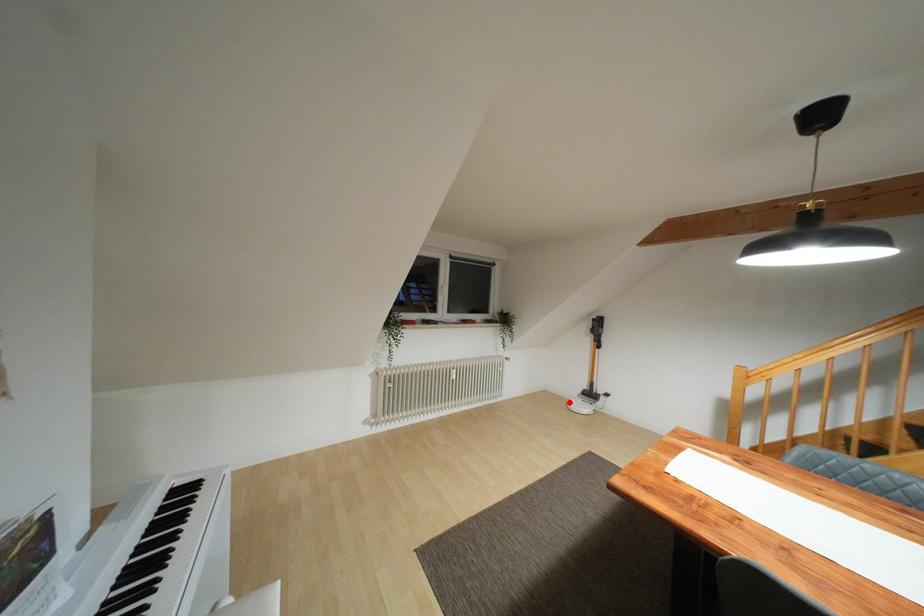
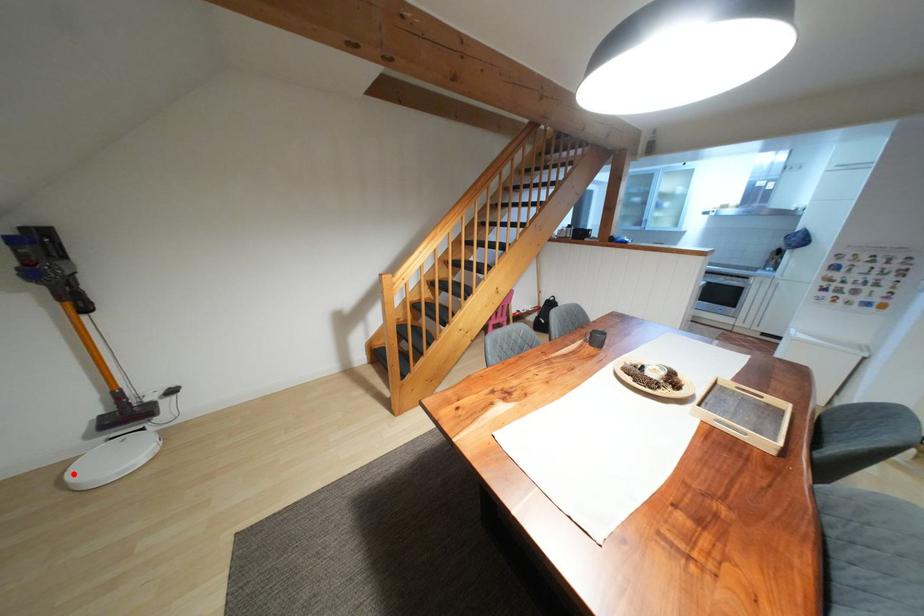
I am providing you with two images of the same scene from different viewpoints. A red point is marked on the first image and another point is marked on the second image. Do the highlighted points in image1 and image2 indicate the same real-world spot?

Yes